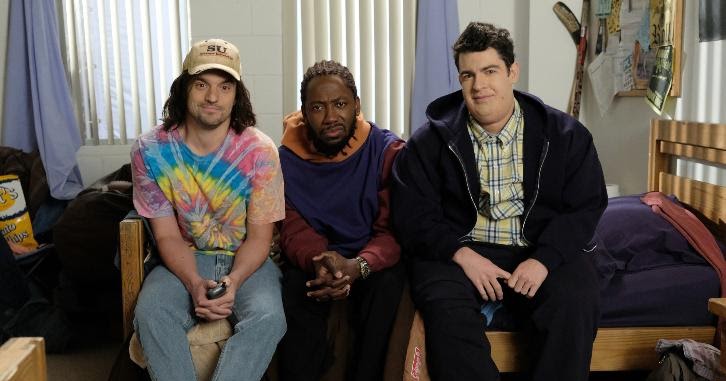
You are a GUI agent. You are given a task and a screenshot of the screen. Output one action in this format:
    pyautogui.click(x=<x>, y=<y>)
    Task: Click on the painted wall
    
    Given the screenshot: What is the action you would take?
    pyautogui.click(x=558, y=54), pyautogui.click(x=616, y=127), pyautogui.click(x=706, y=76)